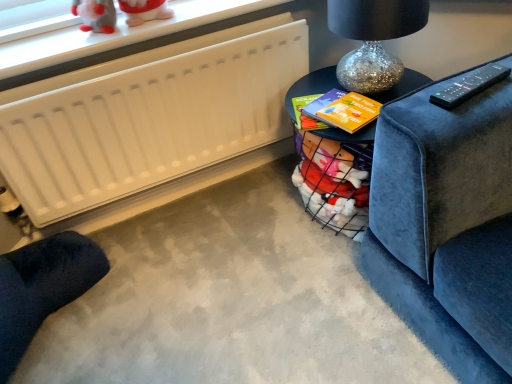
Question: Would you say sparkly glass table lamp at upper right is to the left or to the right of matte black table at upper right, which is the second table from front to back, in the picture?

Choices:
 (A) left
 (B) right

Answer: (B)

Question: Is sparkly glass table lamp at upper right wider or thinner than matte black table at upper right, which is the first table from back to front?

Choices:
 (A) thin
 (B) wide

Answer: (B)

Question: Based on their relative distances, which object is farther from the matte black table at upper right, which is the first table from back to front?

Choices:
 (A) sparkly glass table lamp at upper right
 (B) dark blue fabric footrest at lower left
 (C) white matte radiator at upper left
 (D) black glossy table at center, arranged as the 2th table when viewed from the back

Answer: (B)

Question: Which of these objects is positioned closest to the dark blue fabric footrest at lower left?

Choices:
 (A) sparkly glass table lamp at upper right
 (B) white matte radiator at upper left
 (C) black glossy table at center, arranged as the 2th table when viewed from the back
 (D) matte black table at upper right, which is the first table from back to front

Answer: (B)